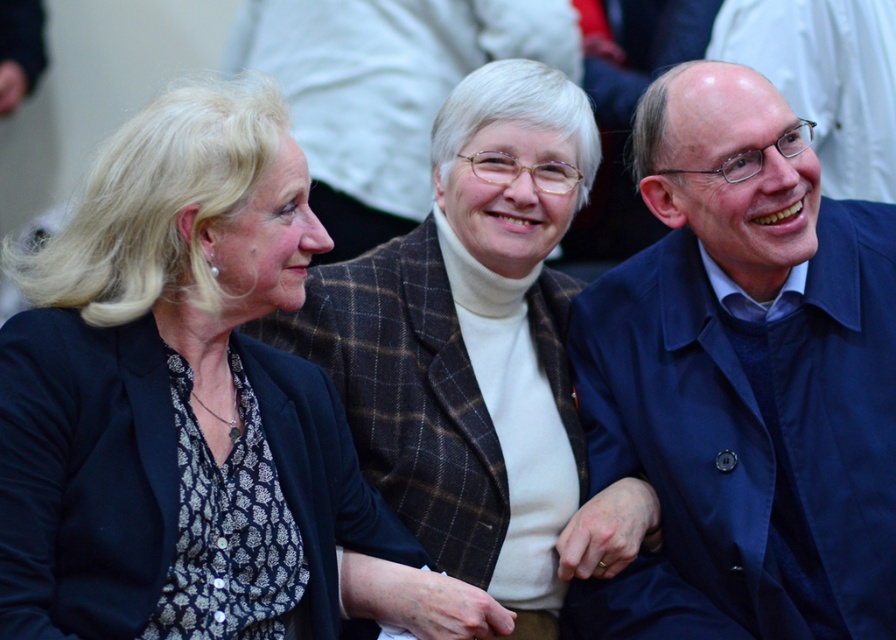
Can you confirm if patterned fabric jacket at center is bigger than matte black blazer at center?

Yes, patterned fabric jacket at center is bigger than matte black blazer at center.

Find the location of a particular element. The width and height of the screenshot is (896, 640). patterned fabric jacket at center is located at coordinates (477, 356).

Is point (541, 476) farther from viewer compared to point (19, 568)?

Yes, point (541, 476) is farther from viewer.

At what (x,y) coordinates should I click in order to perform the action: click on patterned fabric jacket at center. Please return your answer as a coordinate pair (x, y). This screenshot has height=640, width=896. Looking at the image, I should click on (477, 356).

Between blue fabric coat at right and matte black blazer at center, which one is positioned higher?

blue fabric coat at right is above.

Who is shorter, blue fabric coat at right or matte black blazer at center?

matte black blazer at center is shorter.

Locate an element on the screen. Image resolution: width=896 pixels, height=640 pixels. blue fabric coat at right is located at coordinates (743, 380).

Where is `blue fabric coat at right`? blue fabric coat at right is located at coordinates (743, 380).

What do you see at coordinates (743, 380) in the screenshot?
I see `blue fabric coat at right` at bounding box center [743, 380].

Is blue fabric coat at right taller than patterned fabric jacket at center?

No, blue fabric coat at right is not taller than patterned fabric jacket at center.

Which is behind, point (707, 330) or point (513, 253)?

The point (513, 253) is more distant.

The height and width of the screenshot is (640, 896). Identify the location of blue fabric coat at right. (743, 380).